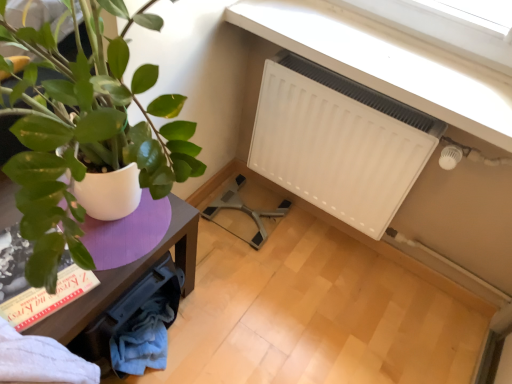
Question: From a real-world perspective, is hardcover book at lower left positioned over purple wood table at left based on gravity?

Choices:
 (A) no
 (B) yes

Answer: (B)

Question: Can you confirm if hardcover book at lower left is taller than purple wood table at left?

Choices:
 (A) yes
 (B) no

Answer: (B)

Question: Is hardcover book at lower left at the left side of purple wood table at left?

Choices:
 (A) no
 (B) yes

Answer: (B)

Question: Does hardcover book at lower left have a lesser width compared to purple wood table at left?

Choices:
 (A) yes
 (B) no

Answer: (A)

Question: From the image's perspective, is hardcover book at lower left under purple wood table at left?

Choices:
 (A) yes
 (B) no

Answer: (B)

Question: Is hardcover book at lower left wider than purple wood table at left?

Choices:
 (A) yes
 (B) no

Answer: (B)

Question: Is white matte radiator at upper right wider than purple wood table at left?

Choices:
 (A) yes
 (B) no

Answer: (B)

Question: Can you confirm if white matte radiator at upper right is positioned to the right of purple wood table at left?

Choices:
 (A) yes
 (B) no

Answer: (A)

Question: From the image's perspective, is white matte radiator at upper right located beneath purple wood table at left?

Choices:
 (A) no
 (B) yes

Answer: (A)

Question: Considering the relative sizes of white matte radiator at upper right and purple wood table at left in the image provided, is white matte radiator at upper right bigger than purple wood table at left?

Choices:
 (A) no
 (B) yes

Answer: (A)

Question: From a real-world perspective, does white matte radiator at upper right stand above purple wood table at left?

Choices:
 (A) yes
 (B) no

Answer: (A)

Question: Could you tell me if white matte radiator at upper right is facing purple wood table at left?

Choices:
 (A) yes
 (B) no

Answer: (A)

Question: From the image's perspective, is purple wood table at left located beneath white matte radiator at upper right?

Choices:
 (A) no
 (B) yes

Answer: (B)